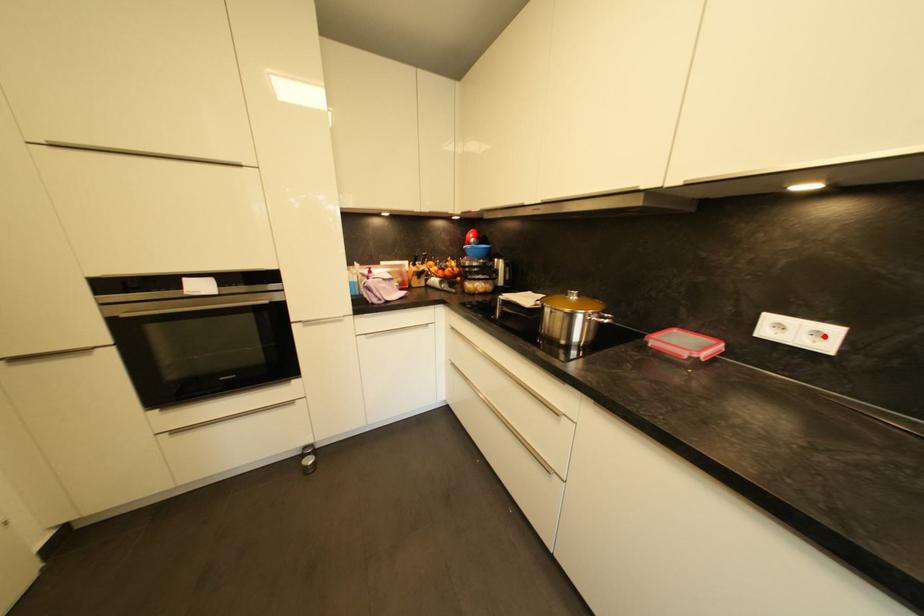
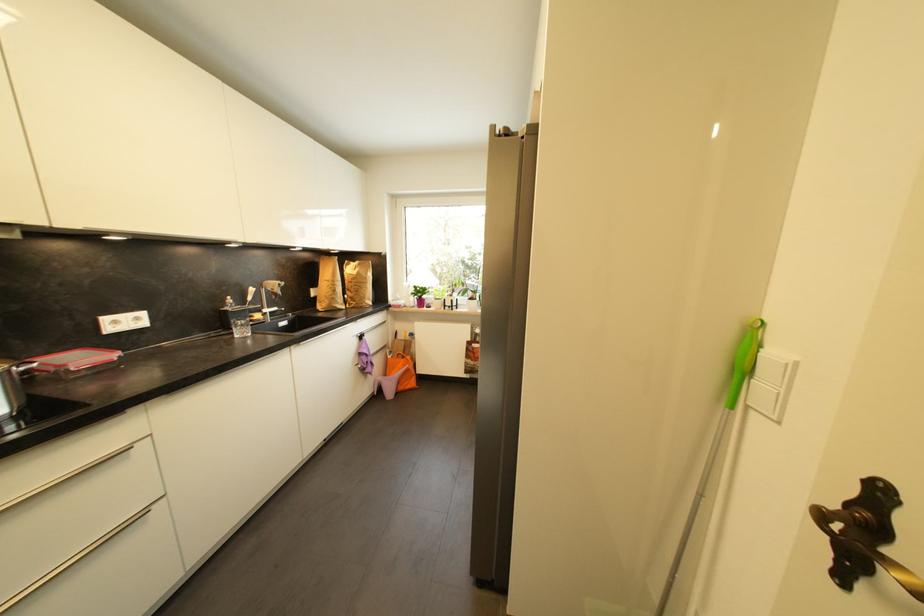
Question: I am providing you with two images of the same scene from different viewpoints. A red point is marked on the first image. At the location where the point appears in image 1, is it still visible in image 2?

Choices:
 (A) Yes
 (B) No

Answer: (A)